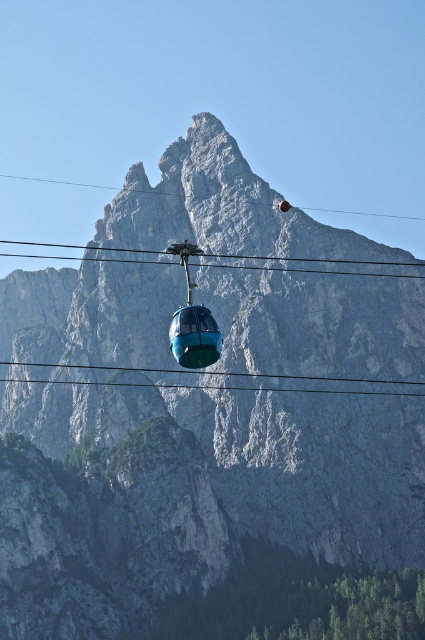
Question: Which point is farther from the camera taking this photo?

Choices:
 (A) (186, 324)
 (B) (249, 388)
 (C) (337, 211)

Answer: (C)

Question: Among these points, which one is farthest from the camera?

Choices:
 (A) (399, 218)
 (B) (184, 326)
 (C) (241, 256)
 (D) (306, 378)

Answer: (A)

Question: Which object appears farthest from the camera in this image?

Choices:
 (A) blue glassy gondola at center
 (B) black cable at center
 (C) blue glossy cable car at center

Answer: (B)

Question: Is black cable at center further to the viewer compared to blue cable car at center?

Choices:
 (A) yes
 (B) no

Answer: (B)

Question: Is blue glassy gondola at center bigger than blue cable car at center?

Choices:
 (A) yes
 (B) no

Answer: (B)

Question: Is blue cable car at center wider than transparent cable at upper center?

Choices:
 (A) no
 (B) yes

Answer: (A)